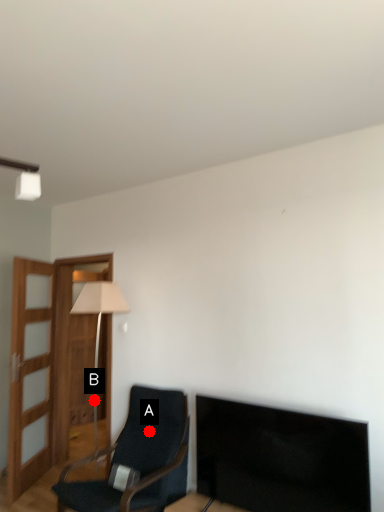
Question: Two points are circled on the image, labeled by A and B beside each circle. Which point is closer to the camera?

Choices:
 (A) A is closer
 (B) B is closer

Answer: (A)